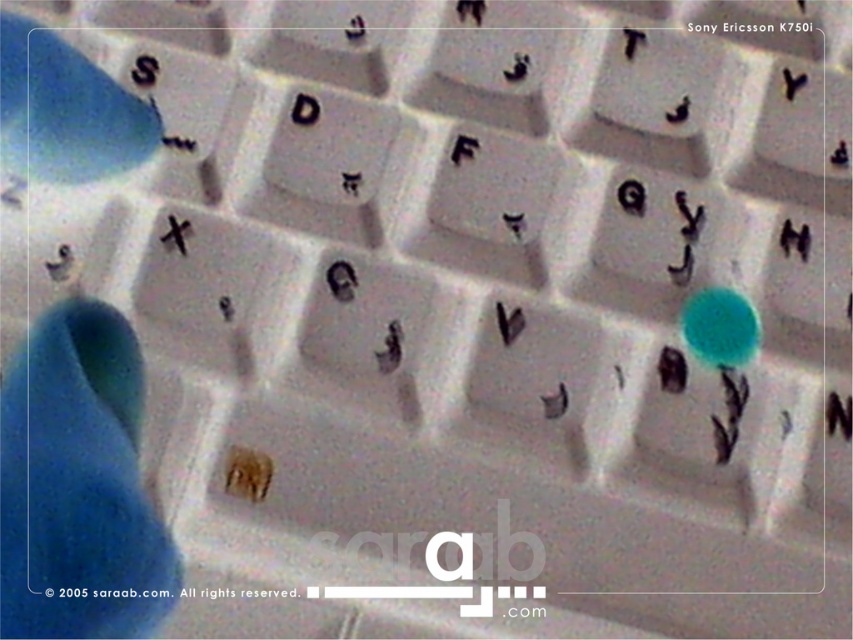
Consider the image. Between blue rubber glove at lower left and blue rubber hand at upper left, which one appears on the left side from the viewer's perspective?

Positioned to the left is blue rubber hand at upper left.

Which is below, blue rubber glove at lower left or blue rubber hand at upper left?

Positioned lower is blue rubber glove at lower left.

Does point (125, 608) come behind point (7, 122)?

No, it is not.

The image size is (853, 640). In order to click on blue rubber glove at lower left in this screenshot , I will do `click(78, 484)`.